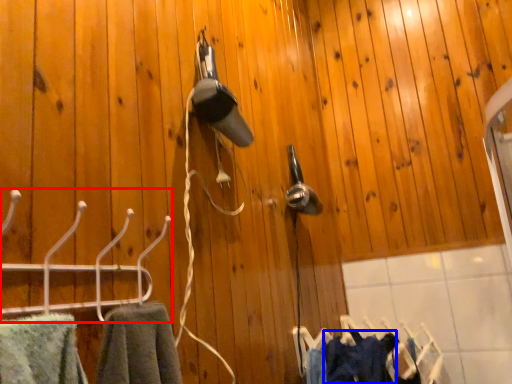
Question: Which object is closer to the camera taking this photo, hanger (highlighted by a red box) or clothing (highlighted by a blue box)?

Choices:
 (A) hanger
 (B) clothing

Answer: (A)